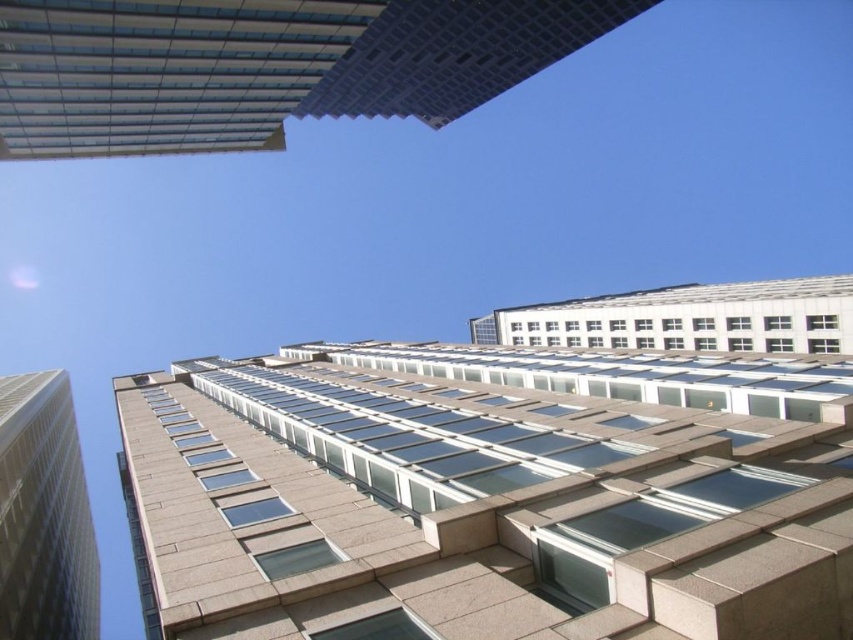
You are a drone operator trying to navigate between two buildings. You need to fly your drone from the beige stone tower at left to the glassy concrete skyscraper at upper left. According to the scene, which direction should you steer the drone to reach the destination?

The glassy concrete skyscraper at upper left is to the right of the beige stone tower at left, so you should steer the drone to the right to reach the destination.

You are standing on the ground floor of a shopping mall and looking up at the glassy concrete skyscraper at upper left and the beige stone tower at left. Which of these two buildings is positioned higher in the sky?

The glassy concrete skyscraper at upper left is positioned higher in the sky than the beige stone tower at left.

You are an architect evaluating the feasibility of installing a large solar panel array on the roof of the glassy concrete skyscraper at upper left and the beige stone tower at left. Considering their sizes, which building would provide more space for the solar panels?

The glassy concrete skyscraper at upper left has a larger size compared to the beige stone tower at left, so it would provide more space for the solar panel array.